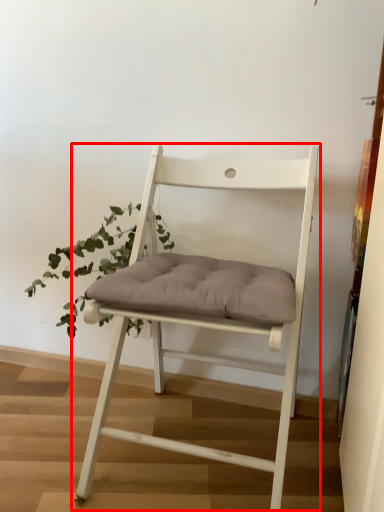
Question: From the image's perspective, where is chair (annotated by the red box) located relative to houseplant?

Choices:
 (A) above
 (B) below

Answer: (B)